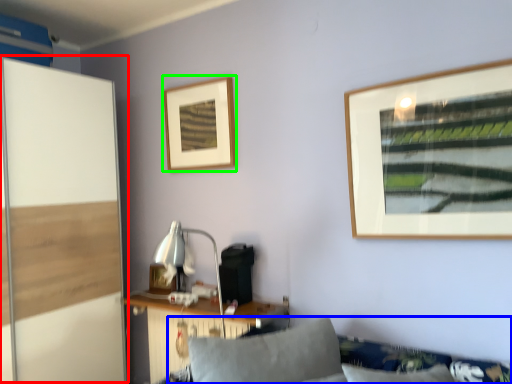
Question: Considering the real-world distances, which object is closest to screen door (highlighted by a red box)? couch (highlighted by a blue box) or picture frame (highlighted by a green box).

Choices:
 (A) couch
 (B) picture frame

Answer: (B)